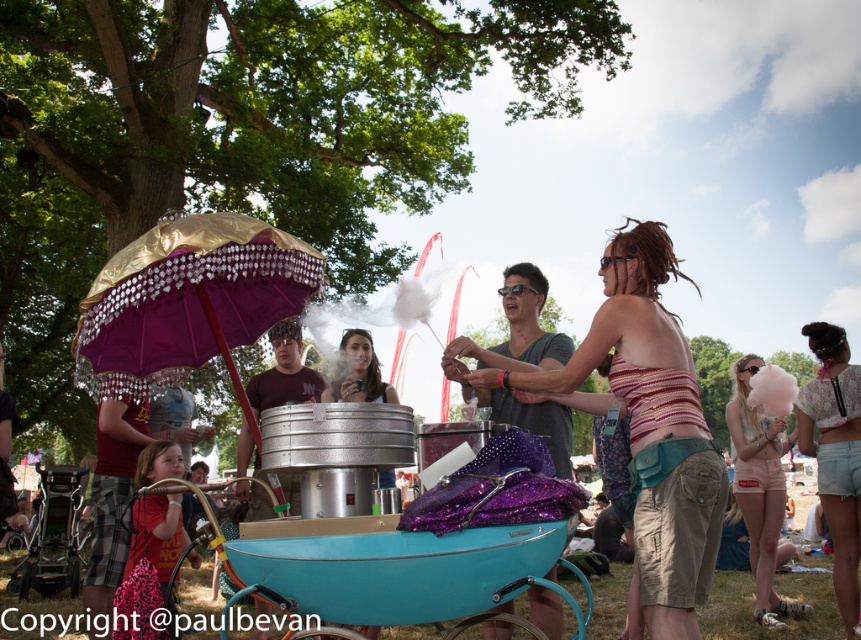
Question: Is striped fabric bikini top at center further to camera compared to light pink denim shorts at lower right?

Choices:
 (A) yes
 (B) no

Answer: (B)

Question: Considering the real-world distances, which object is closest to the light pink denim shorts at lower right?

Choices:
 (A) striped fabric bikini top at center
 (B) white lace top at right

Answer: (B)

Question: Can you confirm if striped fabric bikini top at center is smaller than light pink denim shorts at lower right?

Choices:
 (A) no
 (B) yes

Answer: (B)

Question: Which object is positioned closest to the striped fabric bikini top at center?

Choices:
 (A) white lace top at right
 (B) light pink denim shorts at lower right

Answer: (A)

Question: Which point appears farthest from the camera in this image?

Choices:
 (A) (745, 388)
 (B) (802, 413)
 (C) (493, 384)

Answer: (A)

Question: Is striped fabric bikini top at center thinner than light pink denim shorts at lower right?

Choices:
 (A) yes
 (B) no

Answer: (A)